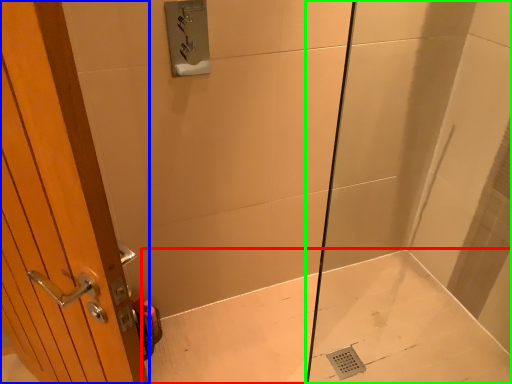
Question: Which object is positioned farthest from bath (highlighted by a red box)? Select from door (highlighted by a blue box) and shower door (highlighted by a green box).

Choices:
 (A) door
 (B) shower door

Answer: (A)